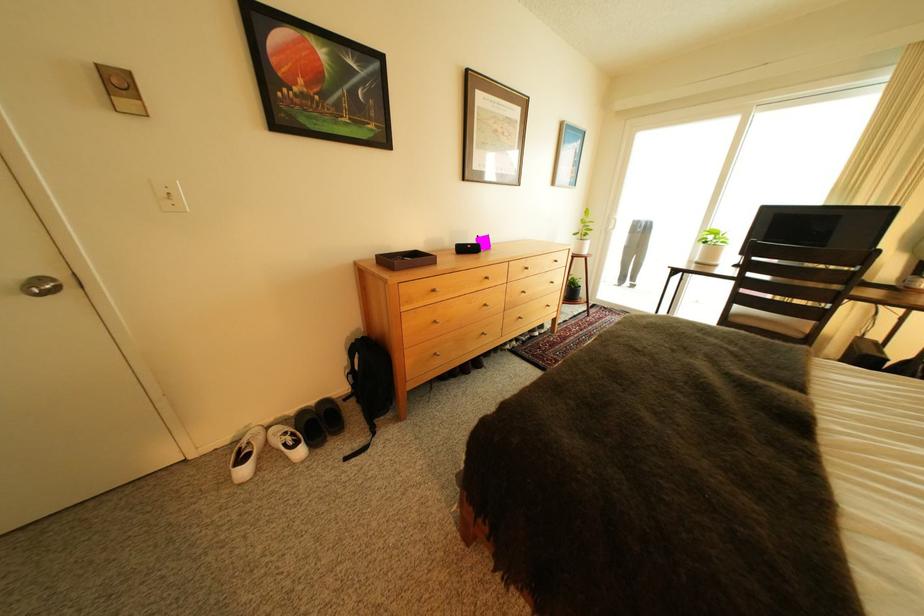
Find where to turn the silver door knob. Please return your answer as a coordinate pair (x, y).

(41, 286)